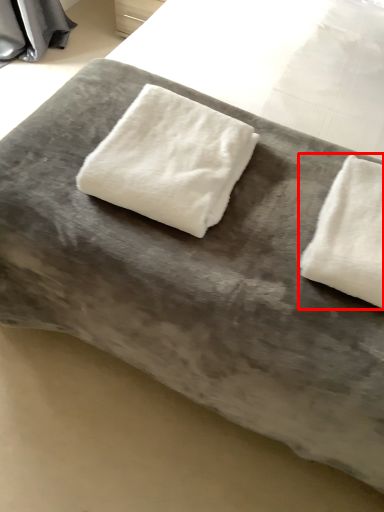
Question: From the image's perspective, where is towel (annotated by the red box) located relative to towel?

Choices:
 (A) above
 (B) below

Answer: (B)